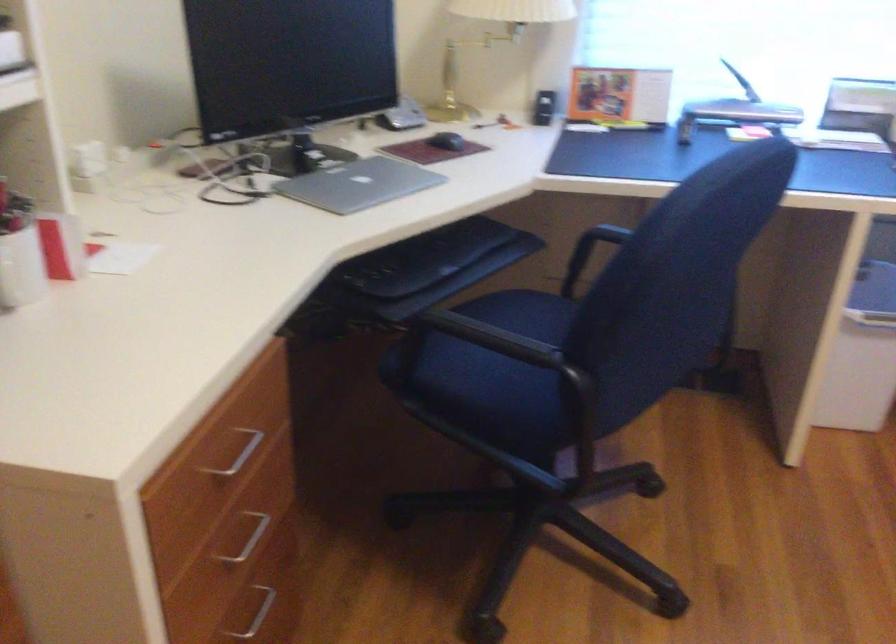
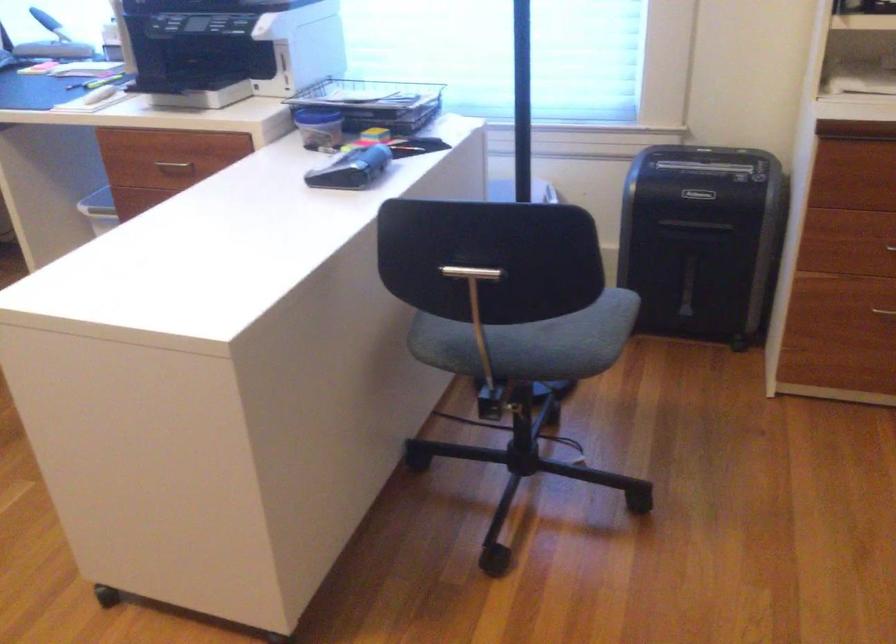
Question: What movement of the cameraman would produce the second image?

Choices:
 (A) Left
 (B) Right
 (C) Forward
 (D) Backward

Answer: (B)